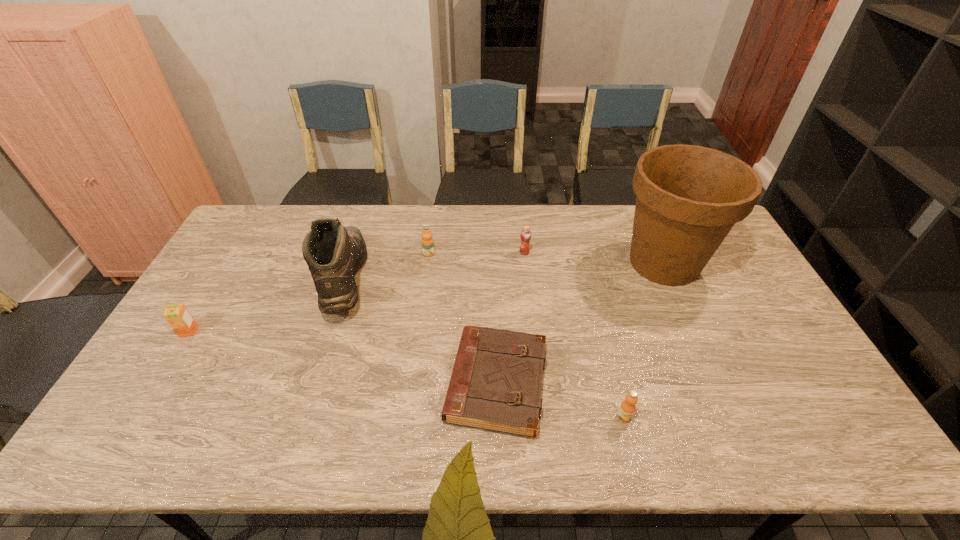
Choose which orange juice is the nearest neighbor to the shortest object. Please provide its 2D coordinates. Your answer should be formatted as a tuple, i.e. [(x, y)], where the tuple contains the x and y coordinates of a point satisfying the conditions above.

[(626, 411)]

Identify the location of orange juice object that ranks as the third closest to the ski boot. The height and width of the screenshot is (540, 960). (525, 235).

Image resolution: width=960 pixels, height=540 pixels. Find the location of `free point that satisfies the following two spatial constraints: 1. on the back side of the second nearest orange juice; 2. on the right side of the sixth shortest object`. free point that satisfies the following two spatial constraints: 1. on the back side of the second nearest orange juice; 2. on the right side of the sixth shortest object is located at coordinates (221, 279).

At what (x,y) coordinates should I click in order to perform the action: click on free spot that satisfies the following two spatial constraints: 1. on the back side of the tallest object; 2. on the left side of the hardback book. Please return your answer as a coordinate pair (x, y). Looking at the image, I should click on (493, 263).